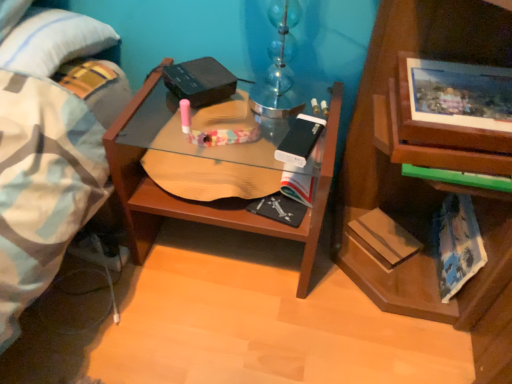
Locate an element on the screen. The height and width of the screenshot is (384, 512). wooden desk at center is located at coordinates (208, 204).

Consider the image. What is the approximate width of blue tie-dye paperback book at lower right, which appears as the third paperback book when viewed from the left?

blue tie-dye paperback book at lower right, which appears as the third paperback book when viewed from the left, is 1.66 inches wide.

In order to face white matte paperback book at center, the first paperback book viewed from the left, should I rotate leftwards or rightwards?

To align with it, rotate right about 6.630°.

The height and width of the screenshot is (384, 512). Identify the location of wooden desk at center. (208, 204).

Could you tell me if hardcover book at lower right, the second paperback book in the left-to-right sequence, is turned towards white matte paperback book at center, the first paperback book viewed from the left?

No, hardcover book at lower right, the second paperback book in the left-to-right sequence, is not facing towards white matte paperback book at center, the first paperback book viewed from the left.

Considering the sizes of objects hardcover book at lower right, the second paperback book in the left-to-right sequence, and white matte paperback book at center, the first paperback book viewed from the left, in the image provided, who is thinner, hardcover book at lower right, the second paperback book in the left-to-right sequence, or white matte paperback book at center, the first paperback book viewed from the left,?

hardcover book at lower right, the second paperback book in the left-to-right sequence, is thinner.

From the image's perspective, is hardcover book at lower right, the second paperback book in the left-to-right sequence, under white matte paperback book at center, acting as the 3th paperback book starting from the right?

Indeed, from the image's perspective, hardcover book at lower right, the second paperback book in the left-to-right sequence, is shown beneath white matte paperback book at center, acting as the 3th paperback book starting from the right.

From the image's perspective, which one is positioned lower, wooden desk at center or white matte paperback book at center, the first paperback book viewed from the left?

wooden desk at center is shown below in the image.

Is wooden desk at center inside the boundaries of white matte paperback book at center, the first paperback book viewed from the left, or outside?

wooden desk at center is spatially situated outside white matte paperback book at center, the first paperback book viewed from the left.

Considering the sizes of objects wooden desk at center and white matte paperback book at center, the first paperback book viewed from the left, in the image provided, who is wider, wooden desk at center or white matte paperback book at center, the first paperback book viewed from the left,?

wooden desk at center.

Is white matte paperback book at center, the first paperback book viewed from the left, inside the boundaries of hardcover book at lower right, the second paperback book in the left-to-right sequence, or outside?

white matte paperback book at center, the first paperback book viewed from the left, is outside hardcover book at lower right, the second paperback book in the left-to-right sequence.

From a real-world perspective, relative to hardcover book at lower right, the second paperback book in the left-to-right sequence, is white matte paperback book at center, the first paperback book viewed from the left, vertically above or below?

Clearly, from a real-world perspective, white matte paperback book at center, the first paperback book viewed from the left, is above hardcover book at lower right, the second paperback book in the left-to-right sequence.

Consider the image. From the image's perspective, which one is positioned higher, white matte paperback book at center, the first paperback book viewed from the left, or hardcover book at lower right, which is the 2th paperback book in right-to-left order?

white matte paperback book at center, the first paperback book viewed from the left, from the image's perspective.

From the image's perspective, is hardcover book at lower right, the second paperback book in the left-to-right sequence, located above or below blue tie-dye paperback book at lower right, which appears as the third paperback book when viewed from the left?

hardcover book at lower right, the second paperback book in the left-to-right sequence, is below blue tie-dye paperback book at lower right, which appears as the third paperback book when viewed from the left.

From their relative heights in the image, would you say hardcover book at lower right, which is the 2th paperback book in right-to-left order, is taller or shorter than blue tie-dye paperback book at lower right, which appears as the third paperback book when viewed from the left?

Considering their sizes, hardcover book at lower right, which is the 2th paperback book in right-to-left order, has less height than blue tie-dye paperback book at lower right, which appears as the third paperback book when viewed from the left.

Are hardcover book at lower right, which is the 2th paperback book in right-to-left order, and blue tie-dye paperback book at lower right, which appears as the 1th paperback book when viewed from the right, beside each other?

No.

Is blue tie-dye paperback book at lower right, which appears as the third paperback book when viewed from the left, at the back of hardcover book at lower right, the second paperback book in the left-to-right sequence?

No, hardcover book at lower right, the second paperback book in the left-to-right sequence,'s orientation is not away from blue tie-dye paperback book at lower right, which appears as the third paperback book when viewed from the left.

In terms of size, does white matte paperback book at center, acting as the 3th paperback book starting from the right, appear bigger or smaller than blue tie-dye paperback book at lower right, which appears as the 1th paperback book when viewed from the right?

white matte paperback book at center, acting as the 3th paperback book starting from the right, is smaller than blue tie-dye paperback book at lower right, which appears as the 1th paperback book when viewed from the right.

Can we say white matte paperback book at center, the first paperback book viewed from the left, lies outside blue tie-dye paperback book at lower right, which appears as the 1th paperback book when viewed from the right?

That's correct, white matte paperback book at center, the first paperback book viewed from the left, is outside of blue tie-dye paperback book at lower right, which appears as the 1th paperback book when viewed from the right.

Between point (287, 161) and point (473, 230), which one is positioned in front?

The point (473, 230) is in front.

Looking at this image, is white matte paperback book at center, the first paperback book viewed from the left, facing towards blue tie-dye paperback book at lower right, which appears as the 1th paperback book when viewed from the right?

No, white matte paperback book at center, the first paperback book viewed from the left, is not aimed at blue tie-dye paperback book at lower right, which appears as the 1th paperback book when viewed from the right.

Is blue tie-dye paperback book at lower right, which appears as the third paperback book when viewed from the left, bigger than hardcover book at lower right, which is the 2th paperback book in right-to-left order?

Correct, blue tie-dye paperback book at lower right, which appears as the third paperback book when viewed from the left, is larger in size than hardcover book at lower right, which is the 2th paperback book in right-to-left order.

From the image's perspective, is blue tie-dye paperback book at lower right, which appears as the third paperback book when viewed from the left, located above or below hardcover book at lower right, which is the 2th paperback book in right-to-left order?

Based on their image positions, blue tie-dye paperback book at lower right, which appears as the third paperback book when viewed from the left, is located above hardcover book at lower right, which is the 2th paperback book in right-to-left order.

Identify the location of paperback book below the blue tie-dye paperback book at lower right, which appears as the 1th paperback book when viewed from the right (from the image's perspective). point(383,238).

Could you tell me if blue tie-dye paperback book at lower right, which appears as the 1th paperback book when viewed from the right, is facing hardcover book at lower right, which is the 2th paperback book in right-to-left order?

Yes, blue tie-dye paperback book at lower right, which appears as the 1th paperback book when viewed from the right, is facing hardcover book at lower right, which is the 2th paperback book in right-to-left order.

Considering the sizes of objects wooden desk at center and blue tie-dye paperback book at lower right, which appears as the 1th paperback book when viewed from the right, in the image provided, who is wider, wooden desk at center or blue tie-dye paperback book at lower right, which appears as the 1th paperback book when viewed from the right,?

wooden desk at center is wider.

Between point (140, 247) and point (452, 231), which one is positioned in front?

Positioned in front is point (452, 231).

Considering the positions of objects wooden desk at center and blue tie-dye paperback book at lower right, which appears as the third paperback book when viewed from the left, in the image provided, who is in front, wooden desk at center or blue tie-dye paperback book at lower right, which appears as the third paperback book when viewed from the left,?

wooden desk at center is more forward.

Could blue tie-dye paperback book at lower right, which appears as the 1th paperback book when viewed from the right, be considered to be inside wooden desk at center?

No, blue tie-dye paperback book at lower right, which appears as the 1th paperback book when viewed from the right, is not a part of wooden desk at center.

The image size is (512, 384). In order to click on paperback book that is the 2nd object located behind the white matte paperback book at center, the first paperback book viewed from the left in this screenshot , I will do `click(383, 238)`.

Identify the location of paperback book above the wooden desk at center (from the image's perspective). The height and width of the screenshot is (384, 512). (300, 140).

Based on their spatial positions, is hardcover book at lower right, which is the 2th paperback book in right-to-left order, or wooden desk at center further from white matte paperback book at center, acting as the 3th paperback book starting from the right?

The object further to white matte paperback book at center, acting as the 3th paperback book starting from the right, is hardcover book at lower right, which is the 2th paperback book in right-to-left order.

Estimate the real-world distances between objects in this image. Which object is further from white matte paperback book at center, acting as the 3th paperback book starting from the right, blue tie-dye paperback book at lower right, which appears as the third paperback book when viewed from the left, or hardcover book at lower right, which is the 2th paperback book in right-to-left order?

blue tie-dye paperback book at lower right, which appears as the third paperback book when viewed from the left, is further to white matte paperback book at center, acting as the 3th paperback book starting from the right.

Estimate the real-world distances between objects in this image. Which object is closer to blue tie-dye paperback book at lower right, which appears as the third paperback book when viewed from the left, wooden desk at center or white matte paperback book at center, acting as the 3th paperback book starting from the right?

The object closer to blue tie-dye paperback book at lower right, which appears as the third paperback book when viewed from the left, is white matte paperback book at center, acting as the 3th paperback book starting from the right.

Estimate the real-world distances between objects in this image. Which object is further from wooden desk at center, white matte paperback book at center, acting as the 3th paperback book starting from the right, or blue tie-dye paperback book at lower right, which appears as the third paperback book when viewed from the left?

The object further to wooden desk at center is blue tie-dye paperback book at lower right, which appears as the third paperback book when viewed from the left.

Which object lies nearer to the anchor point blue tie-dye paperback book at lower right, which appears as the 1th paperback book when viewed from the right, wooden desk at center or hardcover book at lower right, the second paperback book in the left-to-right sequence?

hardcover book at lower right, the second paperback book in the left-to-right sequence, lies closer to blue tie-dye paperback book at lower right, which appears as the 1th paperback book when viewed from the right, than the other object.

From the image, which object appears to be farther from white matte paperback book at center, acting as the 3th paperback book starting from the right, blue tie-dye paperback book at lower right, which appears as the third paperback book when viewed from the left, or wooden desk at center?

blue tie-dye paperback book at lower right, which appears as the third paperback book when viewed from the left, lies further to white matte paperback book at center, acting as the 3th paperback book starting from the right, than the other object.

From the image, which object appears to be nearer to hardcover book at lower right, the second paperback book in the left-to-right sequence, wooden desk at center or blue tie-dye paperback book at lower right, which appears as the third paperback book when viewed from the left?

Among the two, blue tie-dye paperback book at lower right, which appears as the third paperback book when viewed from the left, is located nearer to hardcover book at lower right, the second paperback book in the left-to-right sequence.

From the image, which object appears to be farther from hardcover book at lower right, the second paperback book in the left-to-right sequence, white matte paperback book at center, the first paperback book viewed from the left, or wooden desk at center?

wooden desk at center.

The height and width of the screenshot is (384, 512). Find the location of `paperback book between wooden desk at center and hardcover book at lower right, the second paperback book in the left-to-right sequence`. paperback book between wooden desk at center and hardcover book at lower right, the second paperback book in the left-to-right sequence is located at coordinates (300, 140).

Where is `paperback book situated between white matte paperback book at center, the first paperback book viewed from the left, and blue tie-dye paperback book at lower right, which appears as the third paperback book when viewed from the left, from left to right`? This screenshot has height=384, width=512. paperback book situated between white matte paperback book at center, the first paperback book viewed from the left, and blue tie-dye paperback book at lower right, which appears as the third paperback book when viewed from the left, from left to right is located at coordinates (383, 238).